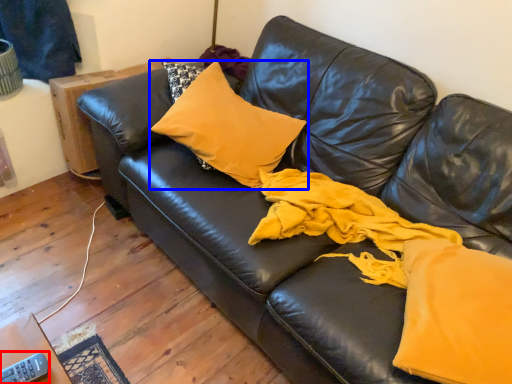
Question: Which object is closer to the camera taking this photo, remote (highlighted by a red box) or pillow (highlighted by a blue box)?

Choices:
 (A) remote
 (B) pillow

Answer: (A)